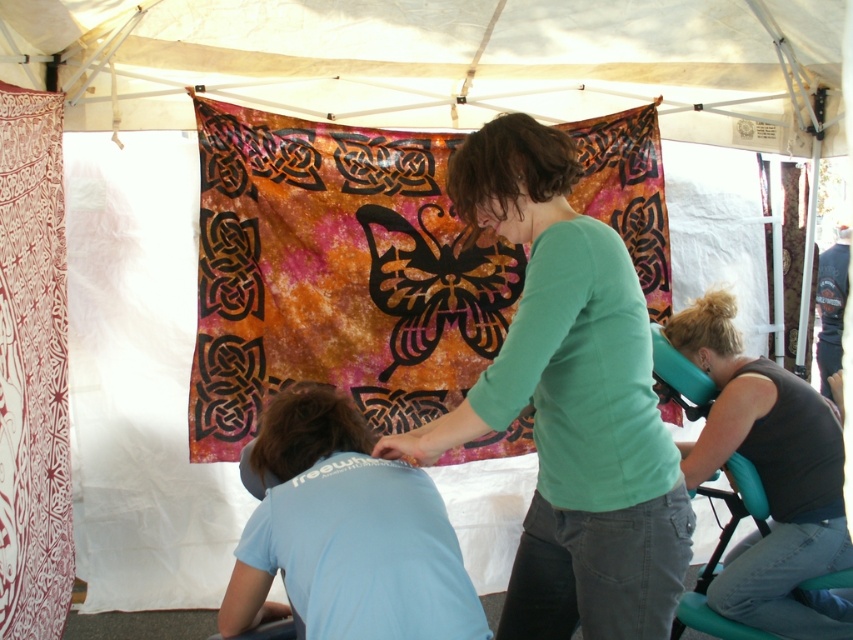
Question: Estimate the real-world distances between objects in this image. Which object is farther from the brown matte hair at center?

Choices:
 (A) white fabric canopy at upper center
 (B) brown curly hair at center

Answer: (A)

Question: Is the position of light blue fabric at center less distant than that of brown matte hair at center?

Choices:
 (A) no
 (B) yes

Answer: (B)

Question: Which point is closer to the camera?

Choices:
 (A) coord(670,321)
 (B) coord(267,442)
 (C) coord(509,124)

Answer: (C)

Question: Considering the relative positions of brown matte hair at center and blonde hair at center in the image provided, where is brown matte hair at center located with respect to blonde hair at center?

Choices:
 (A) left
 (B) right

Answer: (A)

Question: Which point appears farthest from the camera in this image?

Choices:
 (A) (711, 634)
 (B) (502, 179)

Answer: (A)

Question: Is light blue fabric at center further to camera compared to brown curly hair at center?

Choices:
 (A) yes
 (B) no

Answer: (B)